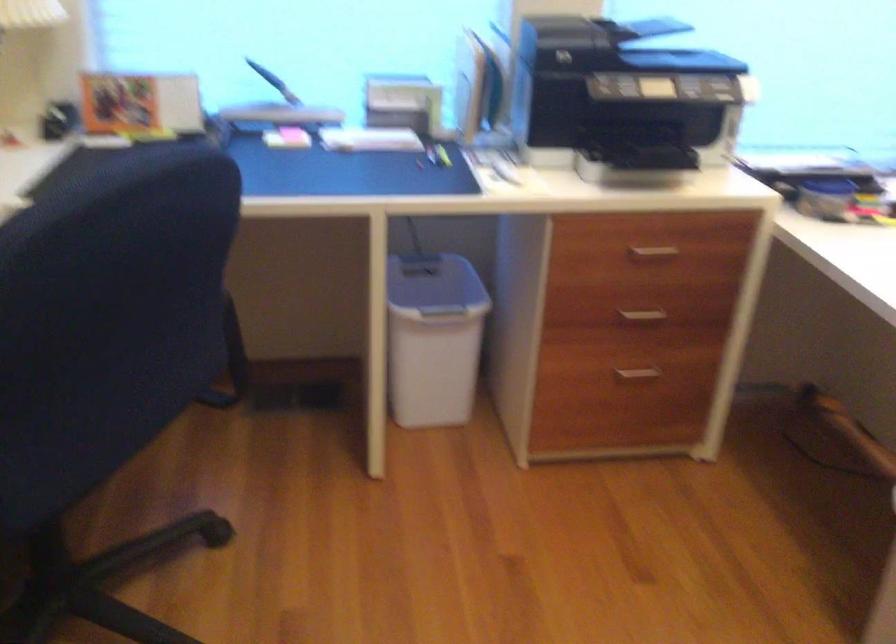
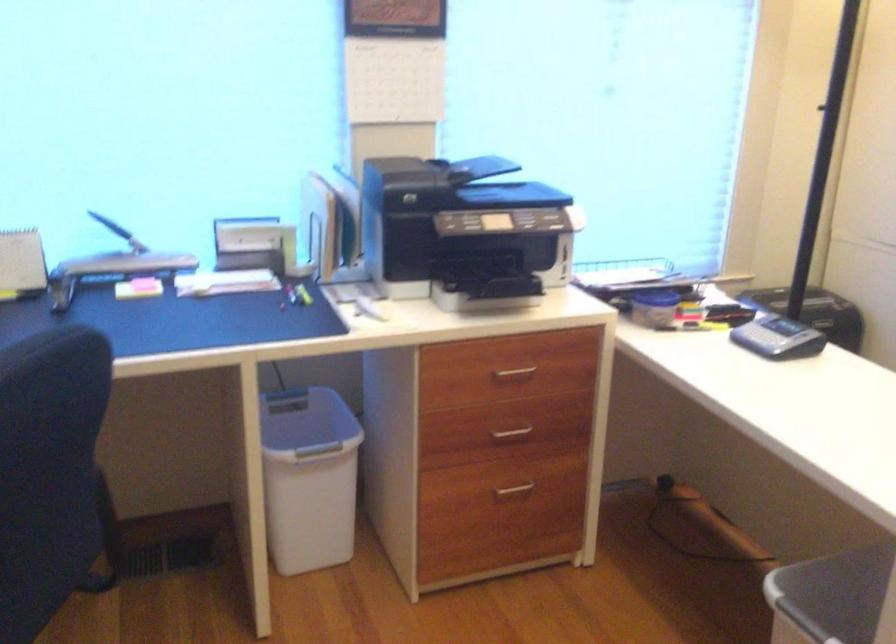
In the second image, find the point that corresponds to the point at 437,290 in the first image.

(306, 424)